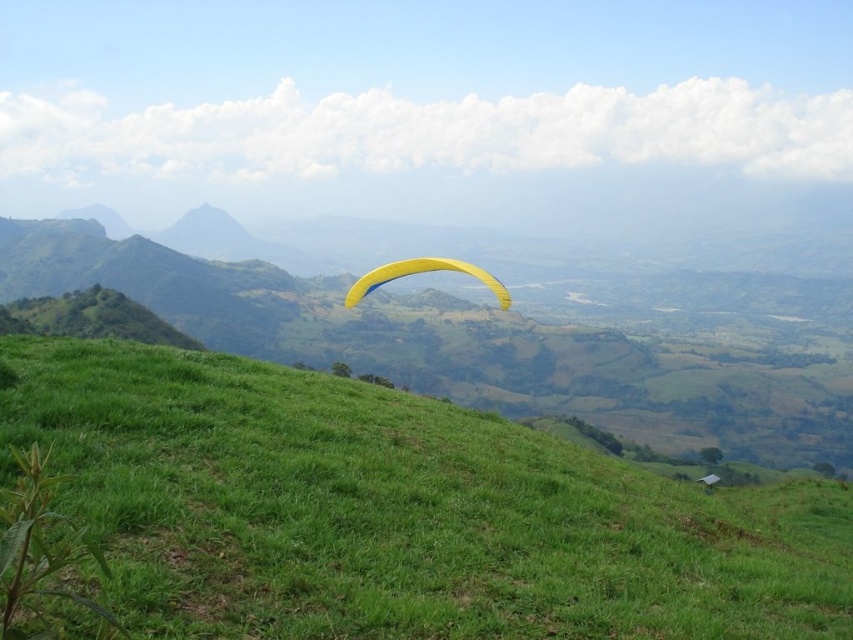
You are a hiker standing on the green grassy hillside at lower center and want to reach the yellow fabric parachute at center. Which direction should you move to get closer to the parachute?

Since the green grassy hillside at lower center is shorter than the yellow fabric parachute at center, you should move upward from the green grassy hillside at lower center to reach the yellow fabric parachute at center.